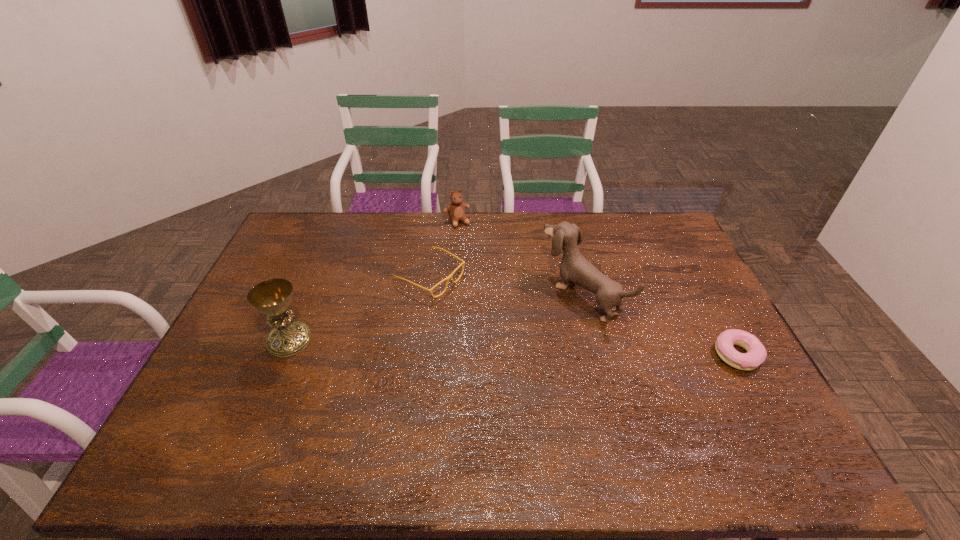
The height and width of the screenshot is (540, 960). What are the coordinates of `free space at the far edge of the desktop` in the screenshot? It's located at (511, 231).

Identify the location of free space at the near edge of the desktop. This screenshot has height=540, width=960. (553, 408).

In the image, there is a desktop. Where is `vacant space at the left edge`? The image size is (960, 540). vacant space at the left edge is located at coordinates (285, 273).

This screenshot has height=540, width=960. Find the location of `free space at the right edge of the desktop`. free space at the right edge of the desktop is located at coordinates (682, 339).

At what (x,y) coordinates should I click in order to perform the action: click on free space at the far left corner. Please return your answer as a coordinate pair (x, y). The image size is (960, 540). Looking at the image, I should click on (323, 217).

Find the location of a particular element. This screenshot has width=960, height=540. vacant space at the near left corner is located at coordinates (224, 424).

Where is `free space at the far right corner`? The width and height of the screenshot is (960, 540). free space at the far right corner is located at coordinates (649, 225).

The image size is (960, 540). In order to click on free space between the spectacles and the puppy in this screenshot , I will do click(506, 286).

This screenshot has height=540, width=960. Find the location of `free spot between the puppy and the leftmost object`. free spot between the puppy and the leftmost object is located at coordinates (435, 318).

The image size is (960, 540). What are the coordinates of `vacant area between the puppy and the spectacles` in the screenshot? It's located at (506, 286).